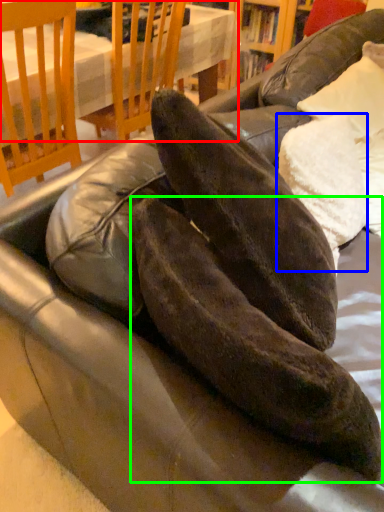
Question: Estimate the real-world distances between objects in this image. Which object is closer to table (highlighted by a red box), pillow (highlighted by a blue box) or leather shoe (highlighted by a green box)?

Choices:
 (A) pillow
 (B) leather shoe

Answer: (A)